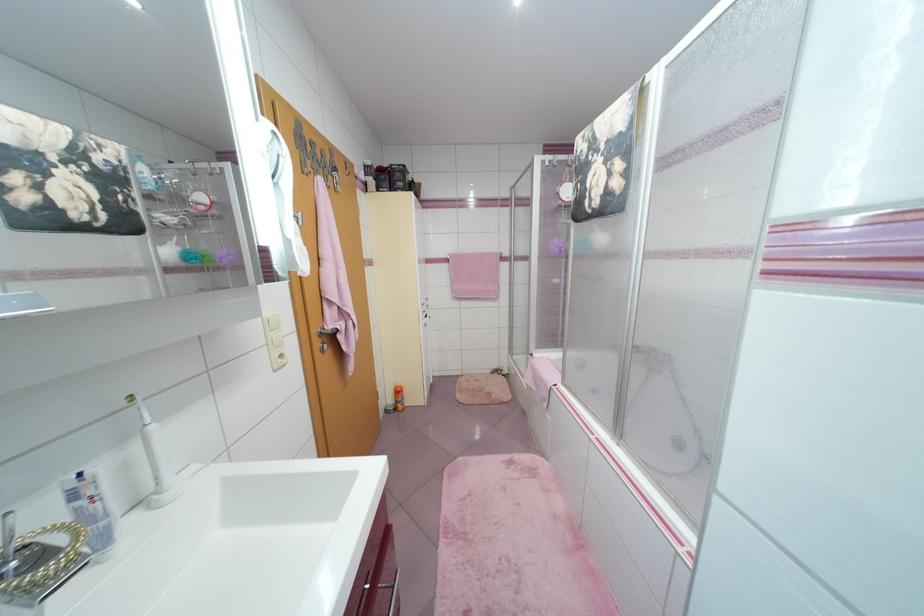
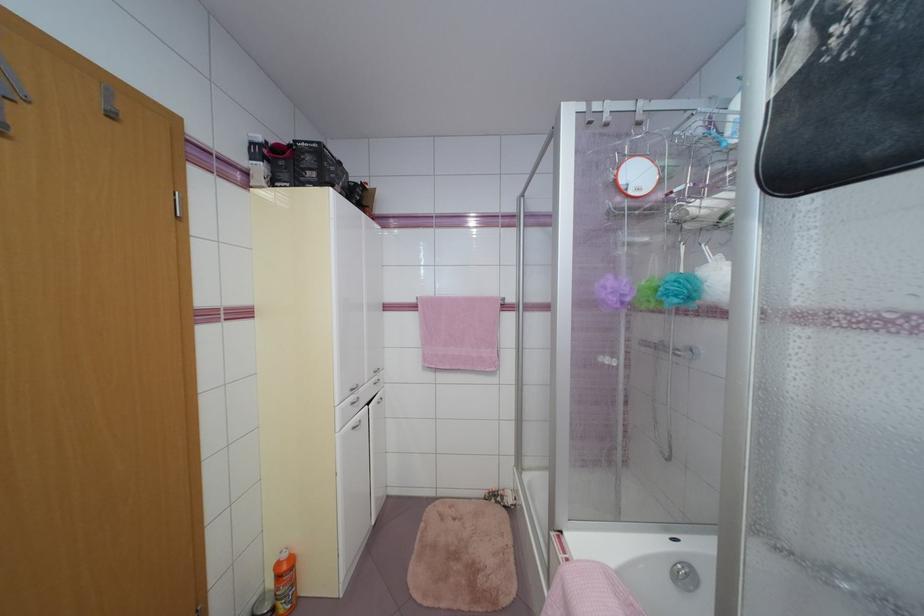
Where in the second image is the point corresponding to point 460,278 from the first image?

(433, 336)